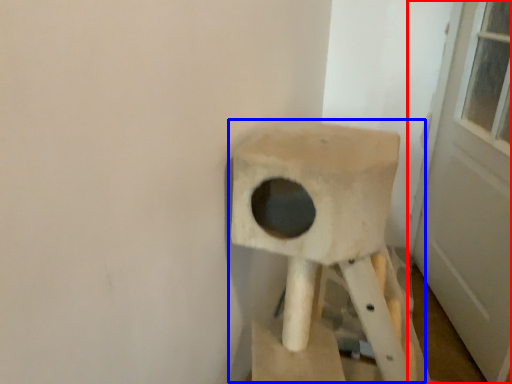
Question: Which of the following is the farthest to the observer, door (highlighted by a red box) or swivel chair (highlighted by a blue box)?

Choices:
 (A) door
 (B) swivel chair

Answer: (A)